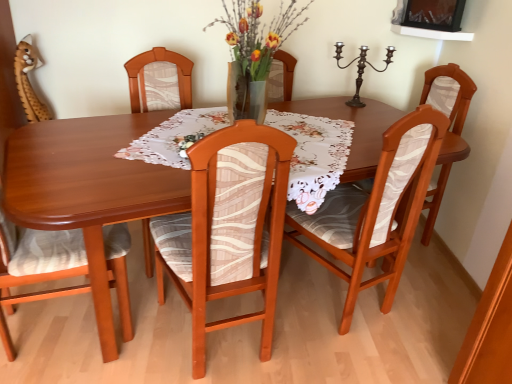
Where is `free space below wooden chair with patterned fabric at center, placed as the third chair when sorted from left to right (from a real-world perspective)`? The height and width of the screenshot is (384, 512). free space below wooden chair with patterned fabric at center, placed as the third chair when sorted from left to right (from a real-world perspective) is located at coordinates (213, 335).